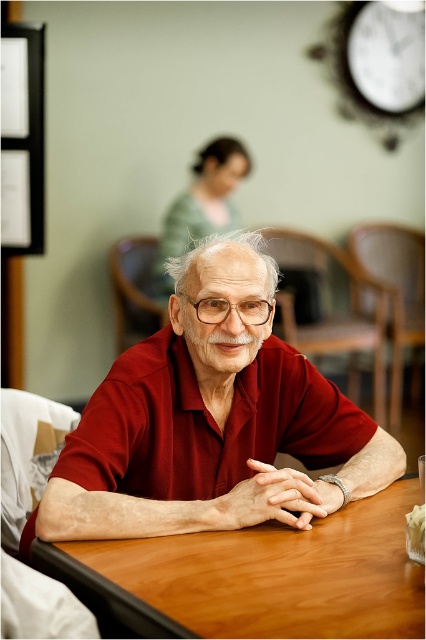
Is matte red shirt at center taller than matte green sweater at upper center?

In fact, matte red shirt at center may be shorter than matte green sweater at upper center.

Is point (63, 449) positioned in front of point (196, 234)?

Yes, it is.

You are a GUI agent. You are given a task and a screenshot of the screen. Output one action in this format:
    pyautogui.click(x=<x>, y=<y>)
    Task: Click on the matte red shirt at center
    Image resolution: width=426 pixels, height=640 pixels.
    Given the screenshot: What is the action you would take?
    pyautogui.click(x=212, y=422)

Can you confirm if white plastic clock at upper right is positioned to the right of matte green sweater at upper center?

Correct, you'll find white plastic clock at upper right to the right of matte green sweater at upper center.

Can you confirm if white plastic clock at upper right is shorter than matte green sweater at upper center?

Indeed, white plastic clock at upper right has a lesser height compared to matte green sweater at upper center.

Identify the location of white plastic clock at upper right. (382, 58).

Between point (183, 586) and point (241, 316), which one is positioned behind?

Positioned behind is point (241, 316).

Looking at this image, which of these two, wooden table at center or transparent plastic glasses at center, stands shorter?

With less height is transparent plastic glasses at center.

Who is more distant from viewer, (356, 531) or (209, 310)?

Positioned behind is point (209, 310).

Where is `wooden table at center`? This screenshot has height=640, width=426. wooden table at center is located at coordinates (256, 577).